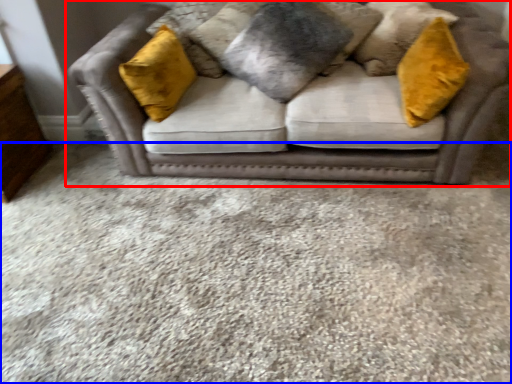
Question: Among these objects, which one is farthest to the camera, studio couch (highlighted by a red box) or plain (highlighted by a blue box)?

Choices:
 (A) studio couch
 (B) plain

Answer: (A)